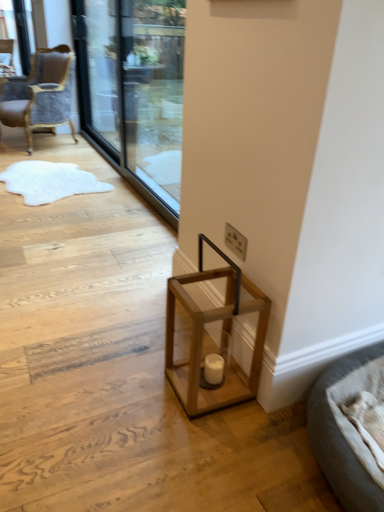
Question: From the image's perspective, is transparent glass screen door at upper center, the 2th screen door viewed from the left, below velvet grey chair at upper left, the 1th chair in the bottom-to-top sequence?

Choices:
 (A) yes
 (B) no

Answer: (A)

Question: Is transparent glass screen door at upper center, the 2th screen door viewed from the left, positioned with its back to velvet grey chair at upper left, the 1th chair from the front?

Choices:
 (A) no
 (B) yes

Answer: (A)

Question: Could velvet grey chair at upper left, which ranks as the second chair in back-to-front order, be considered to be inside transparent glass screen door at upper center, placed as the 1th screen door when sorted from right to left?

Choices:
 (A) no
 (B) yes

Answer: (A)

Question: Considering the relative sizes of transparent glass screen door at upper center, placed as the 1th screen door when sorted from right to left, and velvet grey chair at upper left, which appears as the first chair when viewed from the right, in the image provided, is transparent glass screen door at upper center, placed as the 1th screen door when sorted from right to left, taller than velvet grey chair at upper left, which appears as the first chair when viewed from the right,?

Choices:
 (A) yes
 (B) no

Answer: (A)

Question: Is the depth of transparent glass screen door at upper center, placed as the 1th screen door when sorted from right to left, less than that of velvet grey chair at upper left, the 2th chair in the top-to-bottom sequence?

Choices:
 (A) yes
 (B) no

Answer: (A)

Question: In the image, is matte wooden candle holder at lower center positioned in front of or behind velvet upholstered chair at upper left, which ranks as the first chair in left-to-right order?

Choices:
 (A) front
 (B) behind

Answer: (A)

Question: Does point (208, 358) appear closer or farther from the camera than point (1, 53)?

Choices:
 (A) closer
 (B) farther

Answer: (A)

Question: In terms of width, does matte wooden candle holder at lower center look wider or thinner when compared to velvet upholstered chair at upper left, the first chair when ordered from top to bottom?

Choices:
 (A) wide
 (B) thin

Answer: (B)

Question: From a real-world perspective, is matte wooden candle holder at lower center physically located above or below velvet upholstered chair at upper left, which ranks as the 1th chair in back-to-front order?

Choices:
 (A) below
 (B) above

Answer: (A)

Question: Considering the positions of wooden lantern at lower center and white plastic electric outlet at lower center in the image, is wooden lantern at lower center bigger or smaller than white plastic electric outlet at lower center?

Choices:
 (A) small
 (B) big

Answer: (B)

Question: In the image, is wooden lantern at lower center positioned in front of or behind white plastic electric outlet at lower center?

Choices:
 (A) front
 (B) behind

Answer: (A)

Question: Is wooden lantern at lower center wider or thinner than white plastic electric outlet at lower center?

Choices:
 (A) thin
 (B) wide

Answer: (B)

Question: Is point (198, 323) closer or farther from the camera than point (240, 238)?

Choices:
 (A) farther
 (B) closer

Answer: (B)

Question: From a real-world perspective, relative to matte wooden candle holder at lower center, is gray fabric bed at lower right vertically above or below?

Choices:
 (A) above
 (B) below

Answer: (A)

Question: Is gray fabric bed at lower right taller or shorter than matte wooden candle holder at lower center?

Choices:
 (A) short
 (B) tall

Answer: (B)